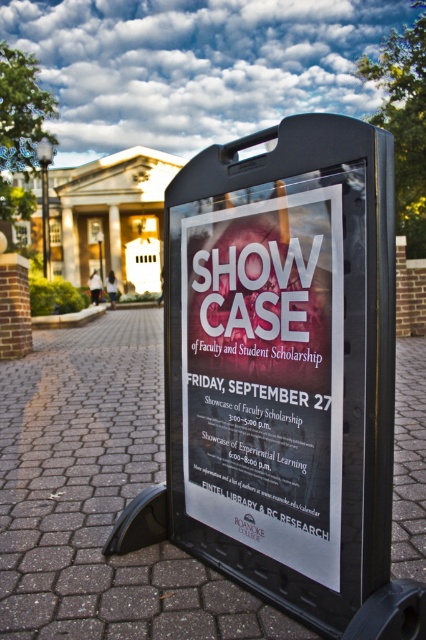
Question: Does brown cobblestone pavement at center appear under black plastic sign at center?

Choices:
 (A) yes
 (B) no

Answer: (A)

Question: Does brown cobblestone pavement at center appear on the left side of white paper poster at center?

Choices:
 (A) yes
 (B) no

Answer: (B)

Question: Does brown cobblestone pavement at center have a lesser width compared to white paper poster at center?

Choices:
 (A) yes
 (B) no

Answer: (B)

Question: Which object appears closest to the camera in this image?

Choices:
 (A) black plastic sign at center
 (B) white paper poster at center
 (C) brown cobblestone pavement at center

Answer: (B)

Question: Which object appears closest to the camera in this image?

Choices:
 (A) black plastic sign at center
 (B) brown cobblestone pavement at center

Answer: (B)

Question: Which object is the farthest from the brown cobblestone pavement at center?

Choices:
 (A) white paper poster at center
 (B) black plastic sign at center

Answer: (B)